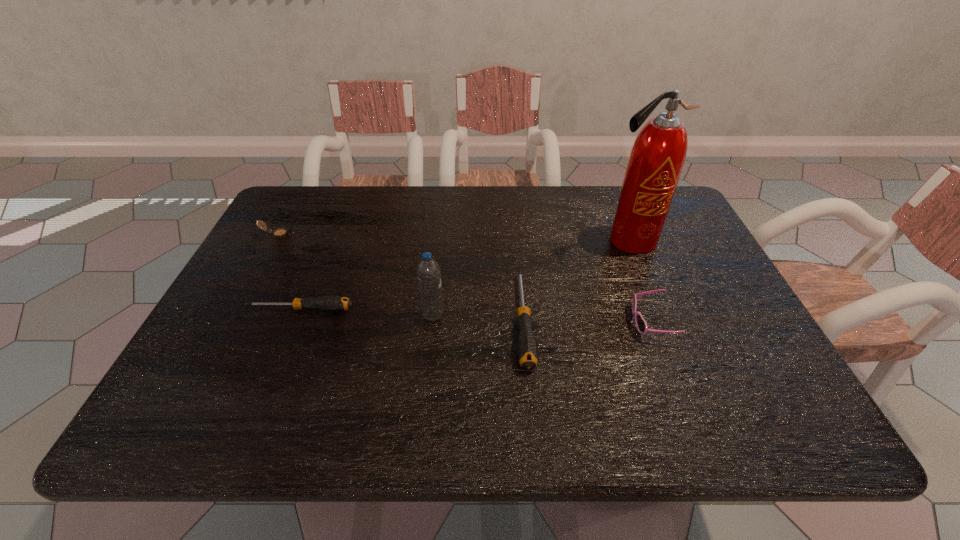
Locate an element on the screen. This screenshot has height=540, width=960. free spot located 0.250m on the left of the taller screwdriver is located at coordinates (405, 320).

Identify the location of vacant area situated 0.310m on the front of the tallest object. The width and height of the screenshot is (960, 540). (671, 345).

Where is `free spot located on the face of the compass`? free spot located on the face of the compass is located at coordinates (410, 234).

The width and height of the screenshot is (960, 540). Find the location of `vacant space located on the front-facing side of the sunglasses`. vacant space located on the front-facing side of the sunglasses is located at coordinates (532, 322).

This screenshot has height=540, width=960. Find the location of `vacant space located 0.400m on the front-facing side of the sunglasses`. vacant space located 0.400m on the front-facing side of the sunglasses is located at coordinates (458, 322).

Where is `vacant space located on the front-facing side of the sunglasses`? This screenshot has width=960, height=540. vacant space located on the front-facing side of the sunglasses is located at coordinates (492, 322).

At what (x,y) coordinates should I click in order to perform the action: click on free space located on the right of the second tallest object. Please return your answer as a coordinate pair (x, y). This screenshot has height=540, width=960. Looking at the image, I should click on (529, 315).

Find the location of a particular element. The height and width of the screenshot is (540, 960). fire extinguisher that is at the far edge is located at coordinates (657, 157).

You are a GUI agent. You are given a task and a screenshot of the screen. Output one action in this format:
    pyautogui.click(x=<x>, y=<y>)
    Task: Click on the compass at the far edge
    
    Given the screenshot: What is the action you would take?
    pyautogui.click(x=282, y=232)

Where is `object that is positioned at the near edge`? This screenshot has width=960, height=540. object that is positioned at the near edge is located at coordinates (527, 350).